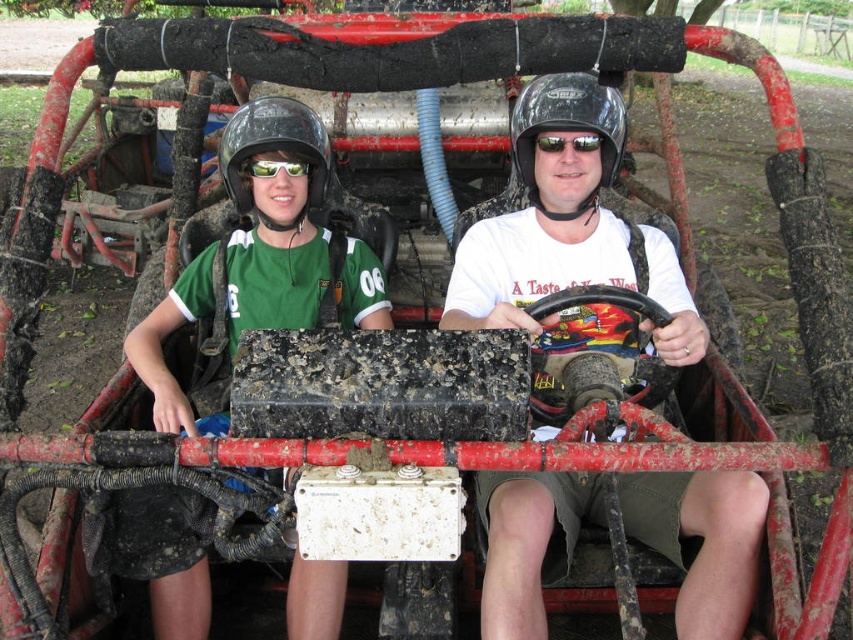
Question: Can you confirm if matte black helmet at center is bigger than glossy plastic helmet at upper left?

Choices:
 (A) no
 (B) yes

Answer: (B)

Question: Which object is the closest to the black matte helmet at center?

Choices:
 (A) green jersey at left
 (B) glossy plastic helmet at upper left

Answer: (B)

Question: Which point is closer to the camera?

Choices:
 (A) black matte helmet at center
 (B) black matte goggles at center
 (C) glossy plastic helmet at upper left
 (D) green jersey at left

Answer: (D)

Question: Is matte black helmet at center thinner than black matte goggles at center?

Choices:
 (A) yes
 (B) no

Answer: (B)

Question: Estimate the real-world distances between objects in this image. Which object is closer to the glossy plastic helmet at upper left?

Choices:
 (A) green jersey at left
 (B) green matte sunglasses at center
 (C) black matte helmet at center
 (D) black matte goggles at center

Answer: (B)

Question: Is black matte helmet at center to the left of green matte sunglasses at center from the viewer's perspective?

Choices:
 (A) yes
 (B) no

Answer: (B)